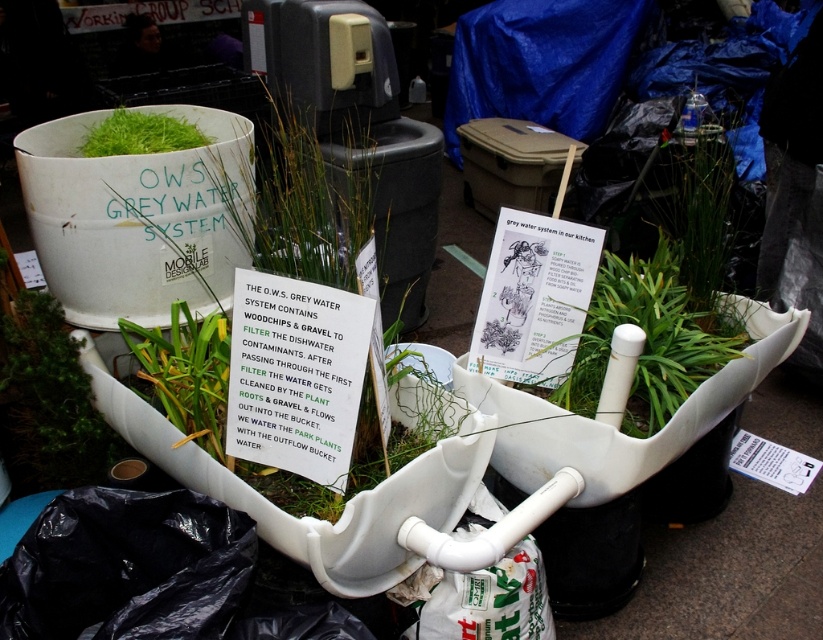
Question: Is green matte plant at lower left to the right of green grassy plant at center from the viewer's perspective?

Choices:
 (A) yes
 (B) no

Answer: (B)

Question: Does green grassy plant at center have a lesser width compared to green grass at upper left?

Choices:
 (A) yes
 (B) no

Answer: (B)

Question: Which of the following is the farthest from the observer?

Choices:
 (A) green matte plant at lower left
 (B) green grassy plant at center
 (C) green leafy plant at center
 (D) green grass at upper left

Answer: (B)

Question: Which point appears closest to the camera in this image?

Choices:
 (A) (644, 208)
 (B) (36, 390)
 (C) (163, 115)
 (D) (649, 394)

Answer: (B)

Question: Does green leafy plant at center lie behind green grassy plant at center?

Choices:
 (A) yes
 (B) no

Answer: (B)

Question: Estimate the real-world distances between objects in this image. Which object is closer to the green matte plant at lower left?

Choices:
 (A) green leafy plant at center
 (B) green grass at upper left

Answer: (B)